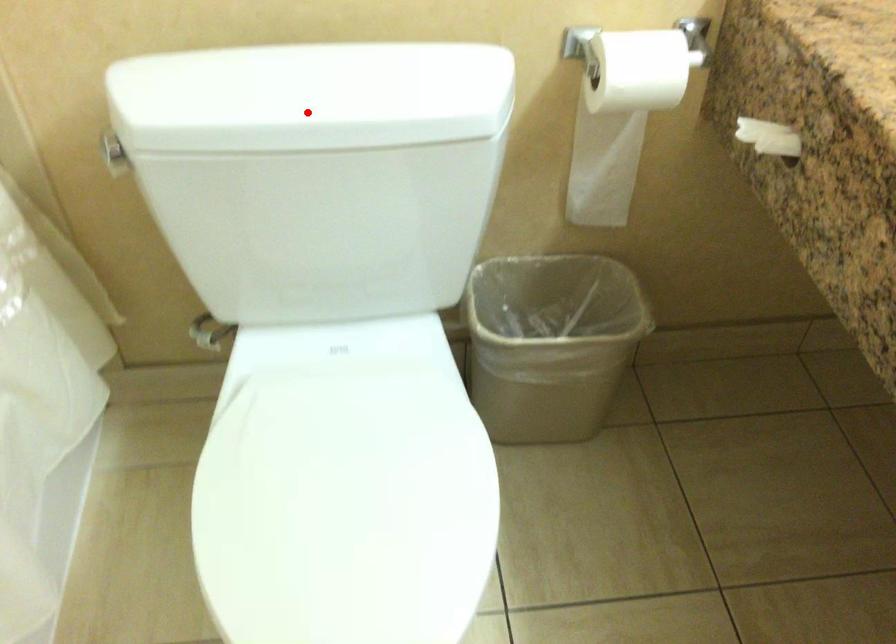
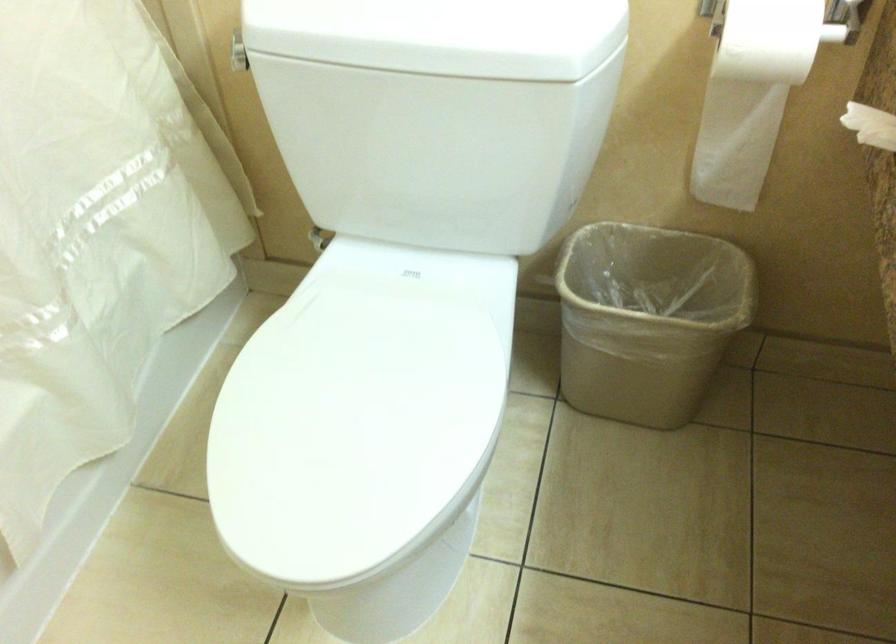
In the second image, find the point that corresponds to the highlighted location in the first image.

(393, 35)